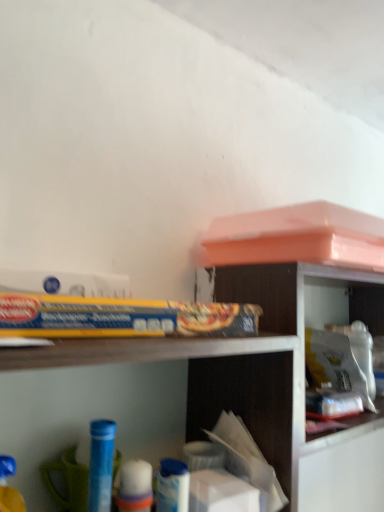
The image size is (384, 512). Describe the element at coordinates (101, 465) in the screenshot. I see `blue plastic tube at lower left, positioned as the 2th toy in front-to-back order` at that location.

Locate an element on the screen. The image size is (384, 512). wooden shelf at upper center is located at coordinates (266, 379).

Is point (11, 457) closer to viewer compared to point (100, 469)?

No.

In the image, is blue plastic toy at lower left, which is the 1th toy in left-to-right order, on the left side or the right side of blue plastic tube at lower left, which ranks as the 1th toy in back-to-front order?

In the image, blue plastic toy at lower left, which is the 1th toy in left-to-right order, appears on the left side of blue plastic tube at lower left, which ranks as the 1th toy in back-to-front order.

Does blue plastic toy at lower left, which appears as the 1th toy when viewed from the front, have a larger size compared to blue plastic tube at lower left, positioned as the 2th toy in front-to-back order?

No.

From the image's perspective, is blue plastic toy at lower left, positioned as the 2th toy in back-to-front order, under blue plastic tube at lower left, which ranks as the 1th toy in back-to-front order?

No, from the image's perspective, blue plastic toy at lower left, positioned as the 2th toy in back-to-front order, is not below blue plastic tube at lower left, which ranks as the 1th toy in back-to-front order.

Find the location of a particular element. This screenshot has height=512, width=384. the 2nd toy to the left of the white plastic container at upper right, starting your count from the anchor is located at coordinates (9, 487).

Is white plastic container at upper right surrounded by blue plastic toy at lower left, which is the 1th toy in left-to-right order?

Definitely not — white plastic container at upper right is not inside blue plastic toy at lower left, which is the 1th toy in left-to-right order.

From the image's perspective, which is below, blue plastic toy at lower left, which is the 1th toy in left-to-right order, or white plastic container at upper right?

blue plastic toy at lower left, which is the 1th toy in left-to-right order, appears lower in the image.

Considering the positions of objects blue plastic toy at lower left, which is the 1th toy in left-to-right order, and white plastic container at upper right in the image provided, who is more to the left, blue plastic toy at lower left, which is the 1th toy in left-to-right order, or white plastic container at upper right?

Positioned to the left is blue plastic toy at lower left, which is the 1th toy in left-to-right order.

Considering the relative positions of wooden shelf at upper center and wooden bookshelf at upper right in the image provided, is wooden shelf at upper center to the left of wooden bookshelf at upper right from the viewer's perspective?

Yes.

Is the position of wooden shelf at upper center more distant than that of wooden bookshelf at upper right?

No, the depth of wooden shelf at upper center is less than that of wooden bookshelf at upper right.

Is wooden shelf at upper center far from wooden bookshelf at upper right?

That's not correct — wooden shelf at upper center is a little close to wooden bookshelf at upper right.

Is wooden shelf at upper center thinner than wooden bookshelf at upper right?

No.

Locate an element on the screen. This screenshot has height=512, width=384. cabinet above the blue plastic toy at lower left, positioned as the 2th toy in back-to-front order (from a real-world perspective) is located at coordinates (325, 294).

Which is nearer, (300, 386) or (18, 490)?

Point (300, 386) is positioned farther from the camera compared to point (18, 490).

Is white plastic container at upper right next to blue plastic toy at lower left, the second toy positioned from the right?

white plastic container at upper right and blue plastic toy at lower left, the second toy positioned from the right, are not in contact.

Considering the relative sizes of white plastic container at upper right and blue plastic toy at lower left, which appears as the 1th toy when viewed from the front, in the image provided, is white plastic container at upper right thinner than blue plastic toy at lower left, which appears as the 1th toy when viewed from the front,?

No, white plastic container at upper right is not thinner than blue plastic toy at lower left, which appears as the 1th toy when viewed from the front.

Looking at this image, is wooden shelf at upper center taller than blue plastic toy at lower left, which appears as the 1th toy when viewed from the front?

Yes, wooden shelf at upper center is taller than blue plastic toy at lower left, which appears as the 1th toy when viewed from the front.

In the scene shown: Is wooden shelf at upper center wider than blue plastic toy at lower left, which appears as the 1th toy when viewed from the front?

Yes.

Is wooden shelf at upper center smaller than blue plastic toy at lower left, which is the 1th toy in left-to-right order?

Incorrect, wooden shelf at upper center is not smaller in size than blue plastic toy at lower left, which is the 1th toy in left-to-right order.

What's the angular difference between blue plastic tube at lower left, which ranks as the 1th toy in back-to-front order, and blue plastic toy at lower left, positioned as the 2th toy in back-to-front order,'s facing directions?

0.00285 degrees separate the facing orientations of blue plastic tube at lower left, which ranks as the 1th toy in back-to-front order, and blue plastic toy at lower left, positioned as the 2th toy in back-to-front order.

This screenshot has width=384, height=512. In the image, there is a blue plastic tube at lower left, which ranks as the 1th toy in back-to-front order. What are the coordinates of `toy above it (from the image's perspective)` in the screenshot? It's located at (9, 487).

From a real-world perspective, is blue plastic tube at lower left, positioned as the 2th toy in front-to-back order, positioned above or below blue plastic toy at lower left, the second toy positioned from the right?

In terms of real-world spatial position, blue plastic tube at lower left, positioned as the 2th toy in front-to-back order, is above blue plastic toy at lower left, the second toy positioned from the right.

Based on the photo, who is bigger, blue plastic tube at lower left, which is counted as the 2th toy, starting from the left, or blue plastic toy at lower left, positioned as the 2th toy in back-to-front order?

blue plastic tube at lower left, which is counted as the 2th toy, starting from the left, is bigger.

Does blue plastic tube at lower left, which is counted as the 1th toy, starting from the right, have a smaller size compared to wooden bookshelf at upper right?

Correct, blue plastic tube at lower left, which is counted as the 1th toy, starting from the right, occupies less space than wooden bookshelf at upper right.

Is point (104, 426) more distant than point (356, 280)?

No, it is in front of (356, 280).

Considering the sizes of objects blue plastic tube at lower left, positioned as the 2th toy in front-to-back order, and wooden bookshelf at upper right in the image provided, who is wider, blue plastic tube at lower left, positioned as the 2th toy in front-to-back order, or wooden bookshelf at upper right?

wooden bookshelf at upper right.

Locate an element on the screen. toy on the left of the blue plastic tube at lower left, which is counted as the 2th toy, starting from the left is located at coordinates (9, 487).

Locate an element on the screen. Image resolution: width=384 pixels, height=512 pixels. cabinet above the blue plastic toy at lower left, which is the 1th toy in left-to-right order (from the image's perspective) is located at coordinates (325, 294).

Considering their positions, is wooden bookshelf at upper right positioned further to white plastic container at upper right than wooden shelf at upper center?

wooden shelf at upper center.

Looking at the image, which one is located further to blue plastic tube at lower left, positioned as the 2th toy in front-to-back order, wooden shelf at upper center or wooden bookshelf at upper right?

wooden bookshelf at upper right is positioned further to the anchor blue plastic tube at lower left, positioned as the 2th toy in front-to-back order.

When comparing their distances from white plastic container at upper right, does blue plastic toy at lower left, which is the 1th toy in left-to-right order, or wooden bookshelf at upper right seem closer?

wooden bookshelf at upper right is closer to white plastic container at upper right.

Based on their spatial positions, is wooden bookshelf at upper right or blue plastic toy at lower left, positioned as the 2th toy in back-to-front order, further from white plastic container at upper right?

The object further to white plastic container at upper right is blue plastic toy at lower left, positioned as the 2th toy in back-to-front order.

Estimate the real-world distances between objects in this image. Which object is closer to blue plastic toy at lower left, which appears as the 1th toy when viewed from the front, wooden bookshelf at upper right or wooden shelf at upper center?

wooden shelf at upper center.

Based on their spatial positions, is white plastic container at upper right or wooden bookshelf at upper right further from blue plastic tube at lower left, positioned as the 2th toy in front-to-back order?

white plastic container at upper right.

Estimate the real-world distances between objects in this image. Which object is further from wooden bookshelf at upper right, blue plastic tube at lower left, which is counted as the 2th toy, starting from the left, or wooden shelf at upper center?

blue plastic tube at lower left, which is counted as the 2th toy, starting from the left.

Based on their spatial positions, is wooden shelf at upper center or blue plastic tube at lower left, which ranks as the 1th toy in back-to-front order, closer to blue plastic toy at lower left, which appears as the 1th toy when viewed from the front?

blue plastic tube at lower left, which ranks as the 1th toy in back-to-front order, is closer to blue plastic toy at lower left, which appears as the 1th toy when viewed from the front.

This screenshot has width=384, height=512. What are the coordinates of `toy between blue plastic toy at lower left, positioned as the 2th toy in back-to-front order, and wooden bookshelf at upper right from left to right` in the screenshot? It's located at (101, 465).

Find the location of a particular element. This screenshot has height=512, width=384. shelf situated between blue plastic tube at lower left, which is counted as the 1th toy, starting from the right, and white plastic container at upper right from left to right is located at coordinates (266, 379).

This screenshot has height=512, width=384. Identify the location of shelf between blue plastic toy at lower left, which appears as the 1th toy when viewed from the front, and white plastic container at upper right. [x=266, y=379].

This screenshot has height=512, width=384. I want to click on toy located between wooden shelf at upper center and blue plastic tube at lower left, which ranks as the 1th toy in back-to-front order, in the depth direction, so click(9, 487).